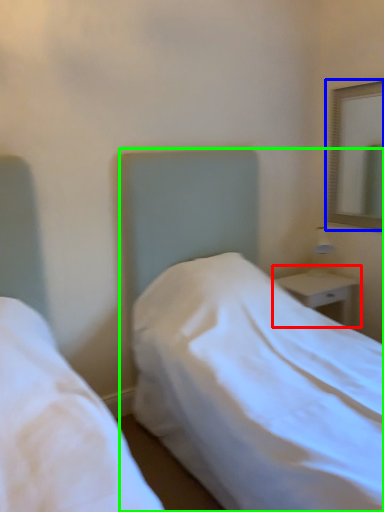
Question: Considering the real-world distances, which object is closest to nightstand (highlighted by a red box)? mirror (highlighted by a blue box) or bed (highlighted by a green box).

Choices:
 (A) mirror
 (B) bed

Answer: (B)